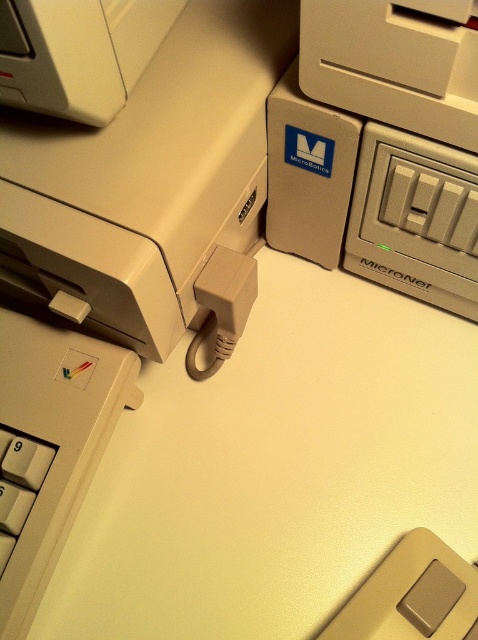
Question: Which of the following is the closest to the observer?

Choices:
 (A) white plastic keyboard at lower left
 (B) matte plastic power outlet at upper right

Answer: (A)

Question: Considering the relative positions of matte plastic printer at center-left and matte plastic power outlet at upper right in the image provided, where is matte plastic printer at center-left located with respect to matte plastic power outlet at upper right?

Choices:
 (A) right
 (B) left

Answer: (B)

Question: Does white matte table at center have a larger size compared to matte plastic printer at center-left?

Choices:
 (A) yes
 (B) no

Answer: (A)

Question: Which object is positioned farthest from the white matte table at center?

Choices:
 (A) matte plastic power outlet at upper right
 (B) matte plastic printer at center-left

Answer: (A)

Question: Which point is closer to the camera?

Choices:
 (A) white plastic keyboard at lower left
 (B) matte plastic printer at center-left

Answer: (B)

Question: Can you confirm if white matte table at center is positioned above white plastic keyboard at lower left?

Choices:
 (A) no
 (B) yes

Answer: (B)